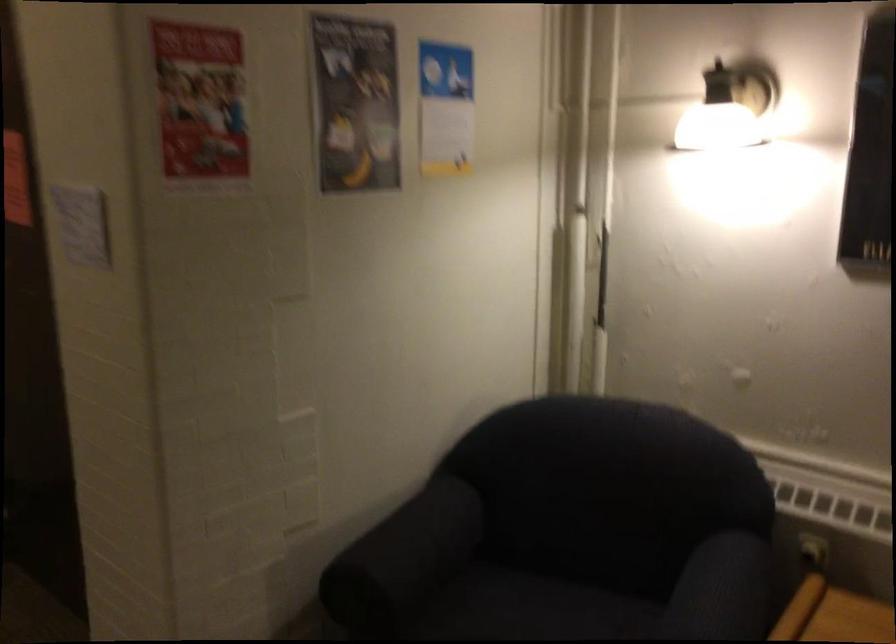
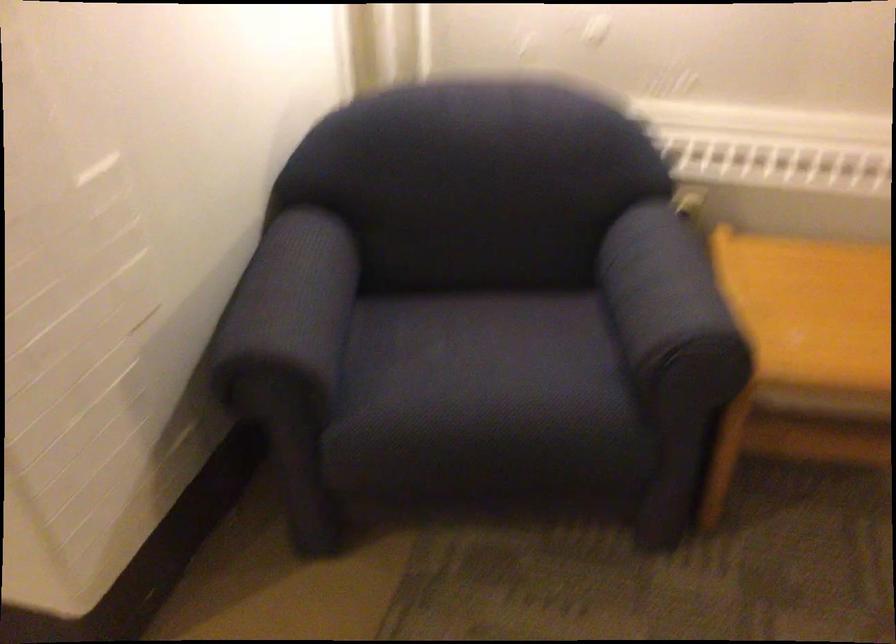
The point at (398, 541) is marked in the first image. Where is the corresponding point in the second image?

(289, 307)